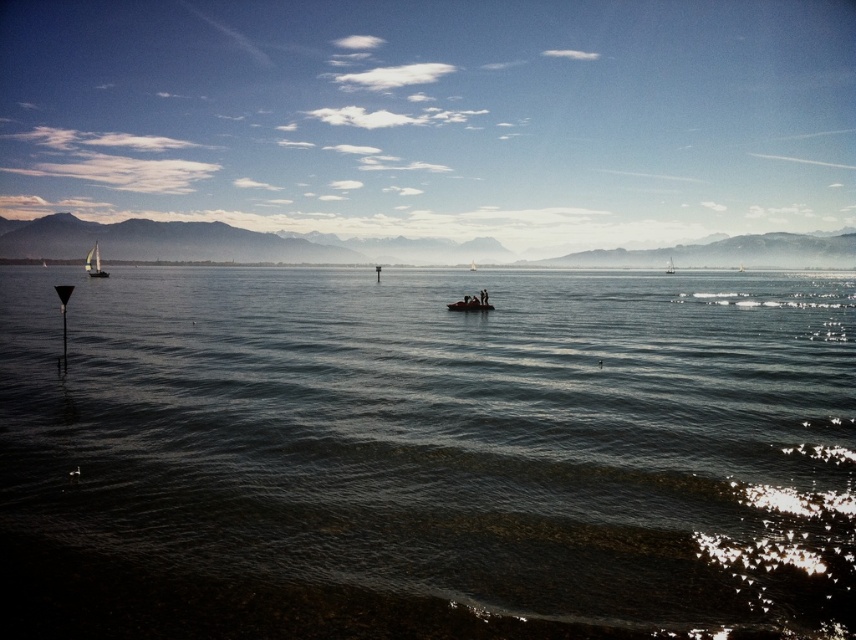
You are standing at the lakeside and want to determine the distance between two points marked on the image. The first point is at coordinates point (x=459, y=304) and the second is at point (x=672, y=266). Given that the first point is closer to you, which point would appear larger in the image?

Point (x=459, y=304) is closer to the camera than point (x=672, y=266), so it would appear larger in the image.

You are planning to take a ride on the lake and want to choose between the metallic silver raft at center and the white sailboat at center. Which one is smaller in size?

The metallic silver raft at center has a smaller size compared to the white sailboat at center, so the metallic silver raft at center is the smaller option.